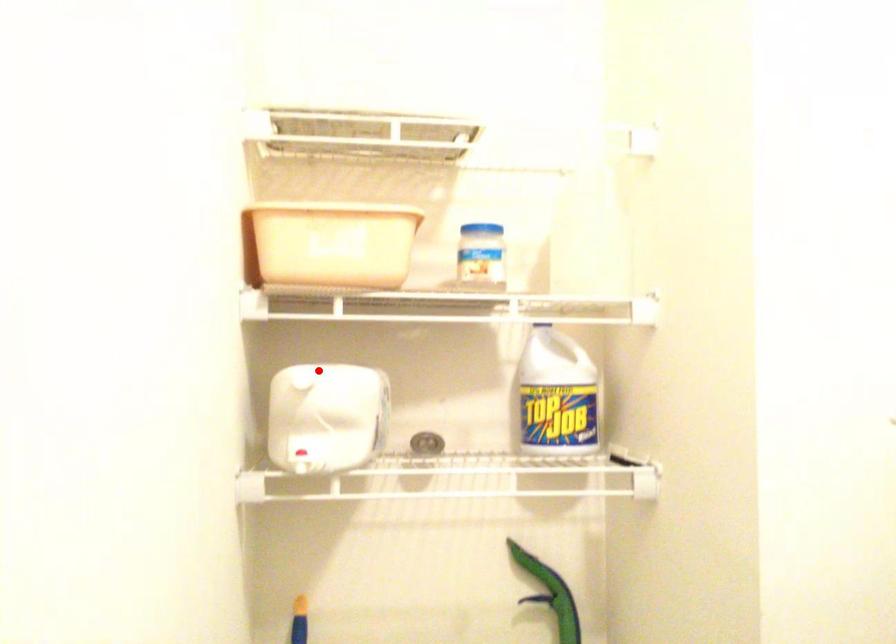
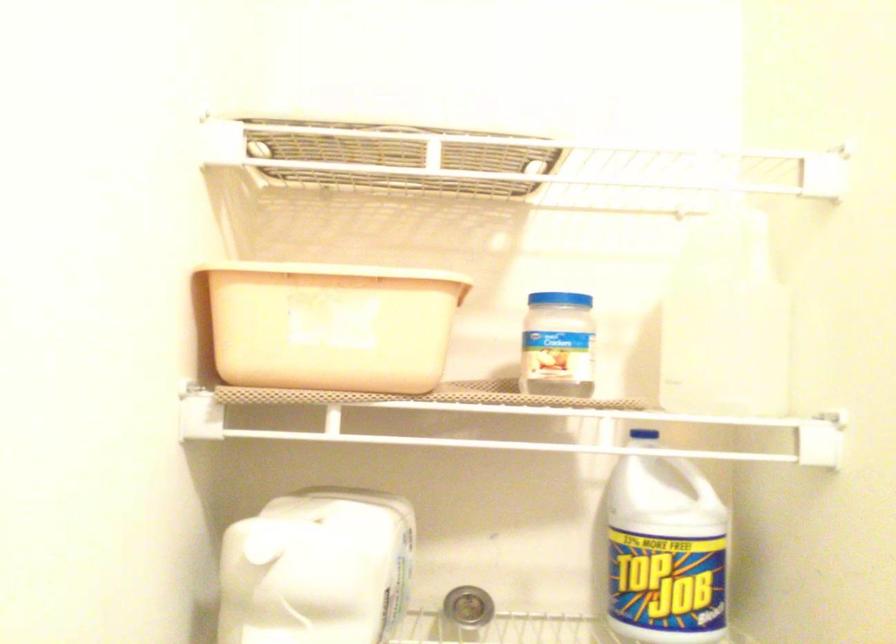
Question: A red point is marked in image1. In image2, is the corresponding 3D point closer to the camera or farther? Reply with the corresponding letter.

Choices:
 (A) The corresponding 3D point is closer.
 (B) The corresponding 3D point is farther.

Answer: (A)